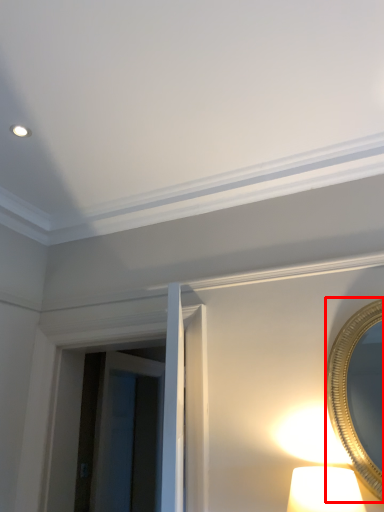
Question: From the image's perspective, what is the correct spatial relationship of mirror (annotated by the red box) in relation to glass door?

Choices:
 (A) above
 (B) below

Answer: (A)